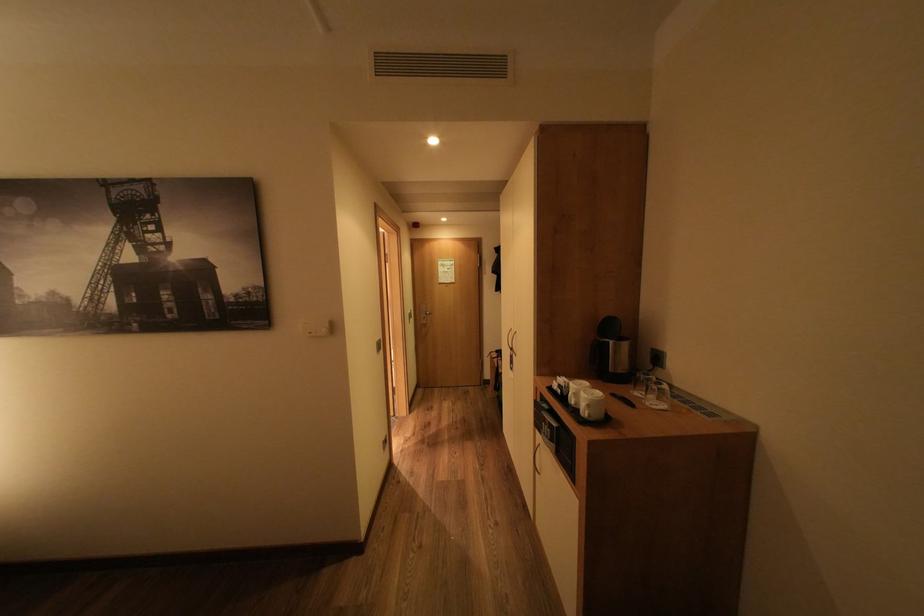
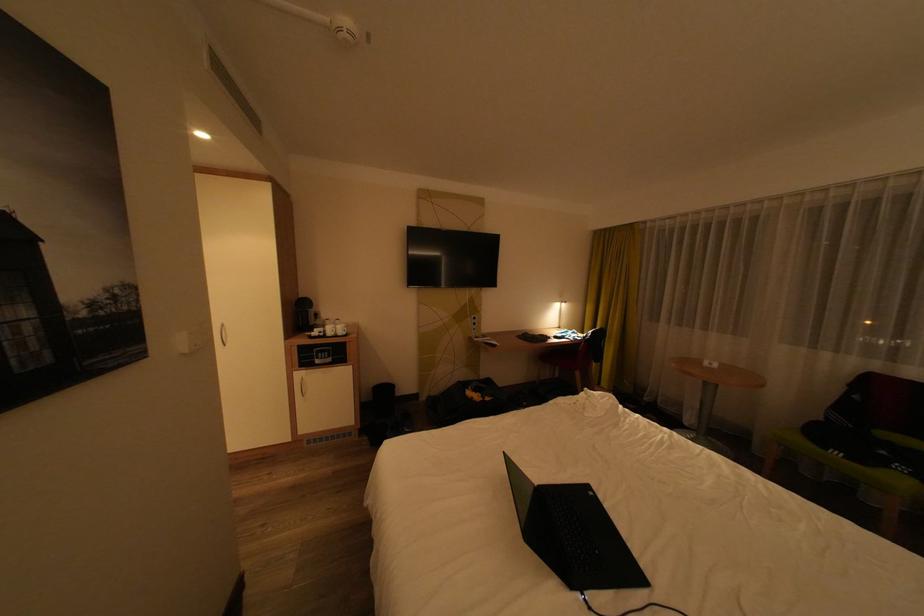
Locate, in the second image, the point that corresponds to point 570,387 in the first image.

(331, 333)